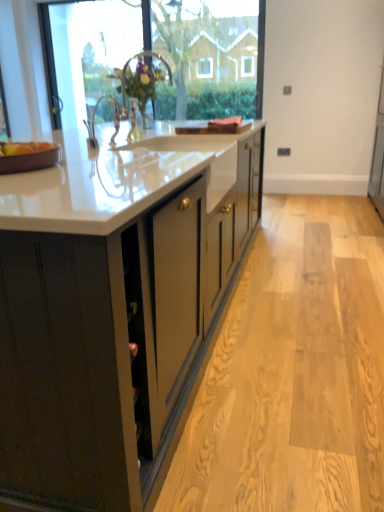
Question: Is matte black cabinets at center located within transparent glass window at upper center?

Choices:
 (A) no
 (B) yes

Answer: (A)

Question: Is matte black cabinets at center at the back of transparent glass window at upper center?

Choices:
 (A) no
 (B) yes

Answer: (A)

Question: From a real-world perspective, is transparent glass window at upper center on top of matte black cabinets at center?

Choices:
 (A) yes
 (B) no

Answer: (A)

Question: Does transparent glass window at upper center have a larger size compared to matte black cabinets at center?

Choices:
 (A) yes
 (B) no

Answer: (B)

Question: Are transparent glass window at upper center and matte black cabinets at center far apart?

Choices:
 (A) no
 (B) yes

Answer: (B)

Question: Is transparent glass window at upper center to the right of matte black cabinets at center from the viewer's perspective?

Choices:
 (A) no
 (B) yes

Answer: (B)

Question: From the image's perspective, is white glossy sink at upper center over transparent glass window at upper center?

Choices:
 (A) no
 (B) yes

Answer: (A)

Question: Does white glossy sink at upper center have a greater width compared to transparent glass window at upper center?

Choices:
 (A) no
 (B) yes

Answer: (B)

Question: Is transparent glass window at upper center inside white glossy sink at upper center?

Choices:
 (A) no
 (B) yes

Answer: (A)

Question: Is white glossy sink at upper center not close to transparent glass window at upper center?

Choices:
 (A) no
 (B) yes

Answer: (B)

Question: From a real-world perspective, does white glossy sink at upper center sit lower than transparent glass window at upper center?

Choices:
 (A) no
 (B) yes

Answer: (B)

Question: Is white glossy sink at upper center completely or partially outside of transparent glass window at upper center?

Choices:
 (A) yes
 (B) no

Answer: (A)

Question: Is matte black cabinets at center not near transparent glass door at upper left?

Choices:
 (A) no
 (B) yes

Answer: (A)